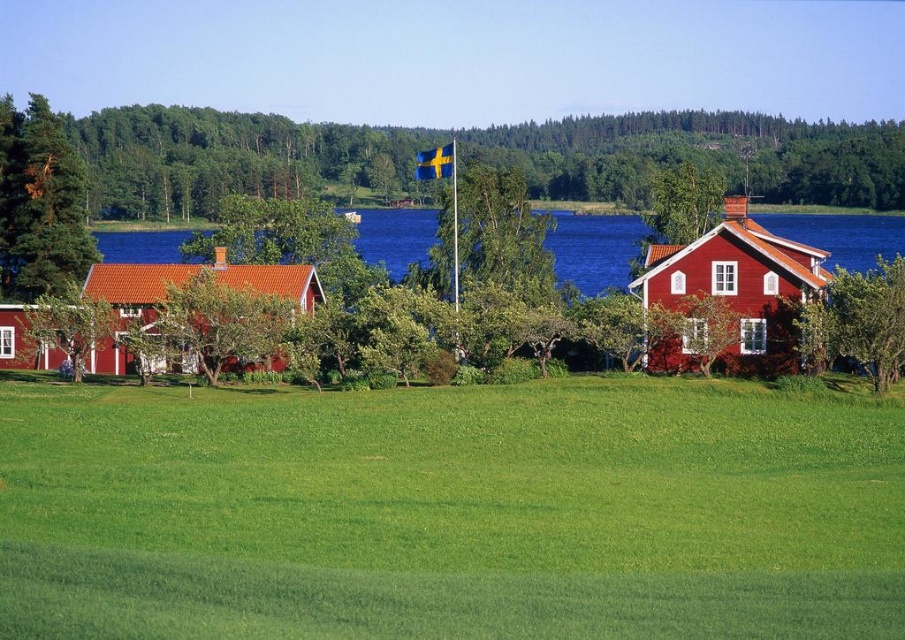
Does green grassy field at lower center have a greater height compared to green pine tree at left?

No, green grassy field at lower center is not taller than green pine tree at left.

Who is higher up, green grassy field at lower center or green pine tree at left?

Positioned higher is green pine tree at left.

Is point (891, 532) positioned behind point (5, 282)?

No, (891, 532) is in front of (5, 282).

In order to click on green grassy field at lower center in this screenshot , I will do pos(450,513).

Can you confirm if green grassy field at lower center is positioned below green leafy tree at lower left?

Correct, green grassy field at lower center is located below green leafy tree at lower left.

In the scene shown: Is the position of green grassy field at lower center more distant than that of green leafy tree at lower left?

No, green grassy field at lower center is closer to the viewer.

Who is more forward, (192, 627) or (26, 312)?

Point (192, 627) is more forward.

Locate an element on the screen. This screenshot has height=640, width=905. green grassy field at lower center is located at coordinates (450, 513).

Who is positioned more to the right, green grassy field at lower center or green leafy tree at upper left?

green grassy field at lower center is more to the right.

Between green grassy field at lower center and green leafy tree at upper left, which one is positioned lower?

green grassy field at lower center

Is point (449, 416) more distant than point (722, 173)?

No, (449, 416) is closer to viewer.

What are the coordinates of `green grassy field at lower center` in the screenshot? It's located at (450, 513).